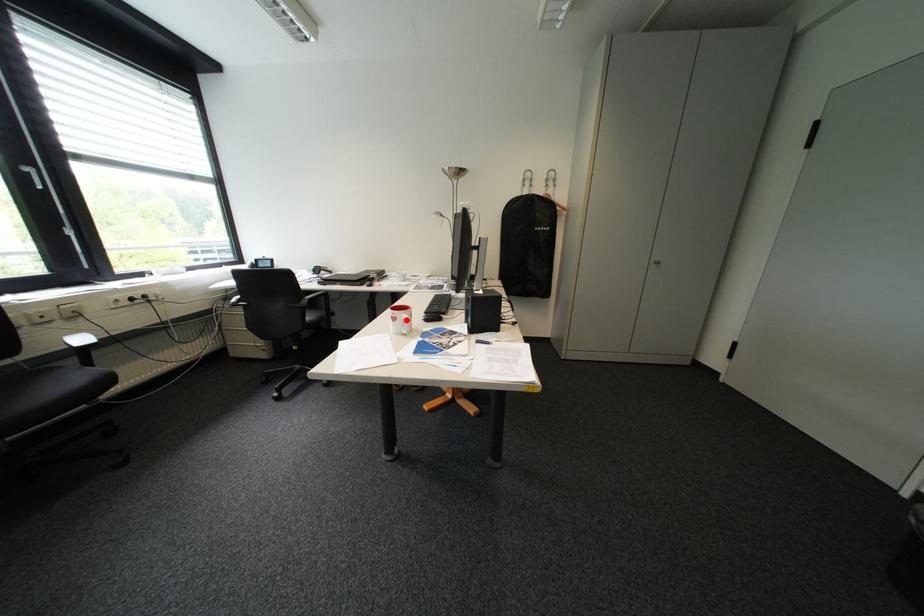
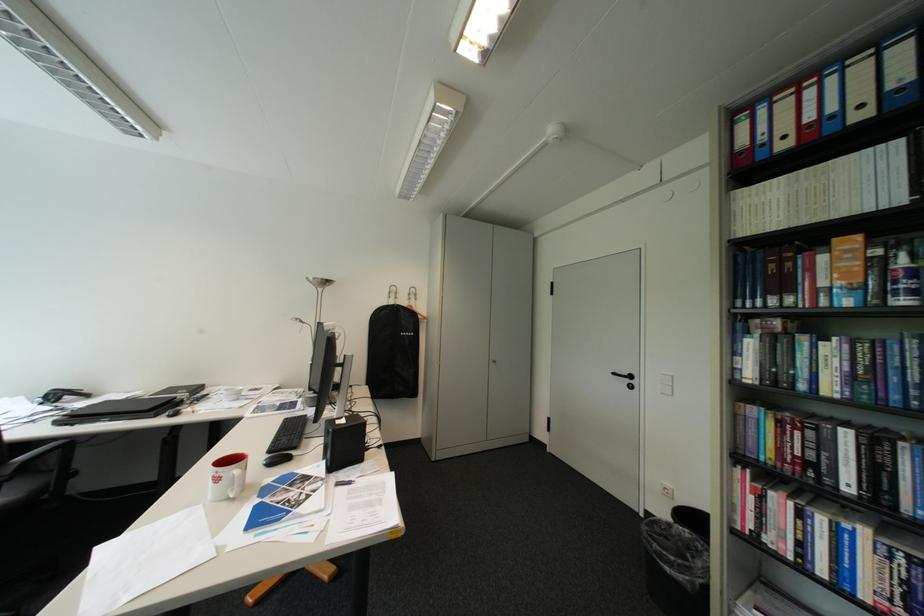
Where in the second image is the point corresponding to the highlighted location from the first image?

(228, 480)